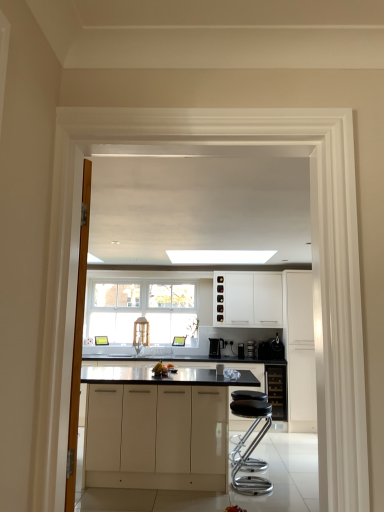
Question: Is white matte cabinetry at center, the 1th cabinetry positioned from the left, inside or outside of white matte cabinet at center, the 1th cabinetry viewed from the back?

Choices:
 (A) outside
 (B) inside

Answer: (A)

Question: From the image's perspective, is white matte cabinetry at center, which is the 4th cabinetry from back to front, positioned above or below white matte cabinet at center, the fourth cabinetry positioned from the front?

Choices:
 (A) above
 (B) below

Answer: (B)

Question: Which is farther from the white matte cabinet at right, placed as the 4th cabinetry when sorted from left to right?

Choices:
 (A) black leather stool at lower center
 (B) metallic silver coffee machine at center, which ranks as the 2th appliance in left-to-right order
 (C) white matte cabinet at center, marked as the 2th cabinetry in a left-to-right arrangement
 (D) black glass wine cabinet at center, which is counted as the 3th cabinetry, starting from the left
 (E) satin black coffee machine at center

Answer: (A)

Question: Which object is the farthest from the white matte cabinet at right, positioned as the third cabinetry in back-to-front order?

Choices:
 (A) metallic silver coffee machine at center, which ranks as the 2th appliance in left-to-right order
 (B) black leather stool at lower center
 (C) satin silver toaster at center, arranged as the 1th appliance when viewed from the left
 (D) black plastic coffee maker at right, which is the first appliance in right-to-left order
 (E) white matte cabinetry at center, the 1th cabinetry positioned from the left

Answer: (E)